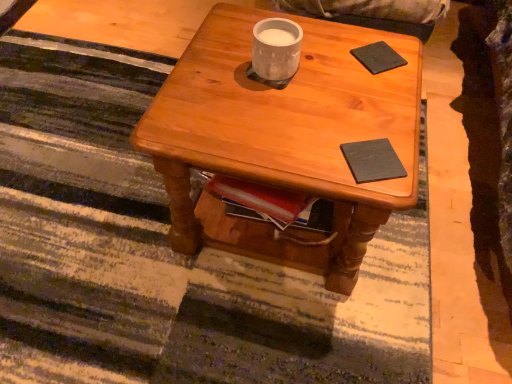
Identify the location of unoccupied area behind black matte pad at upper right, which is the first pad in top-to-bottom order. The width and height of the screenshot is (512, 384). (368, 36).